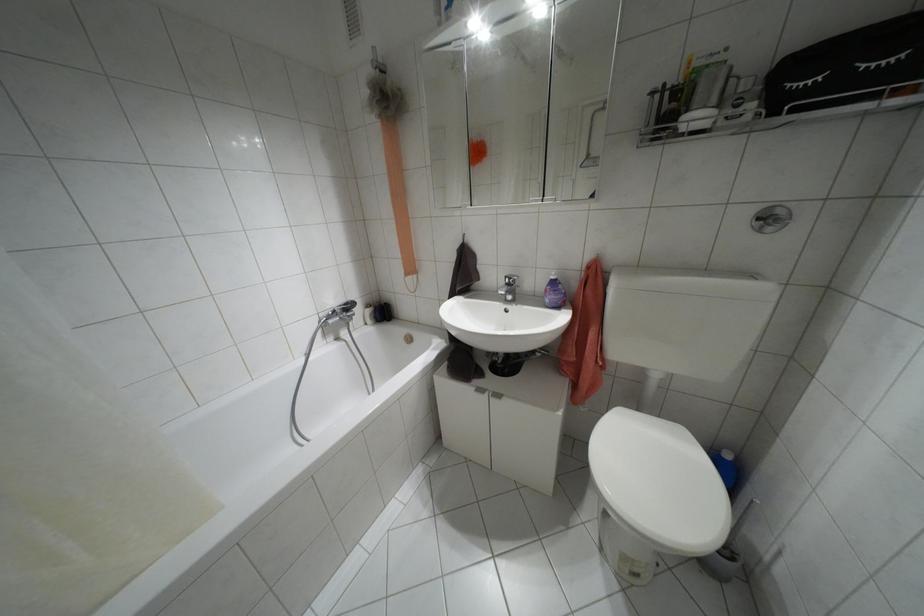
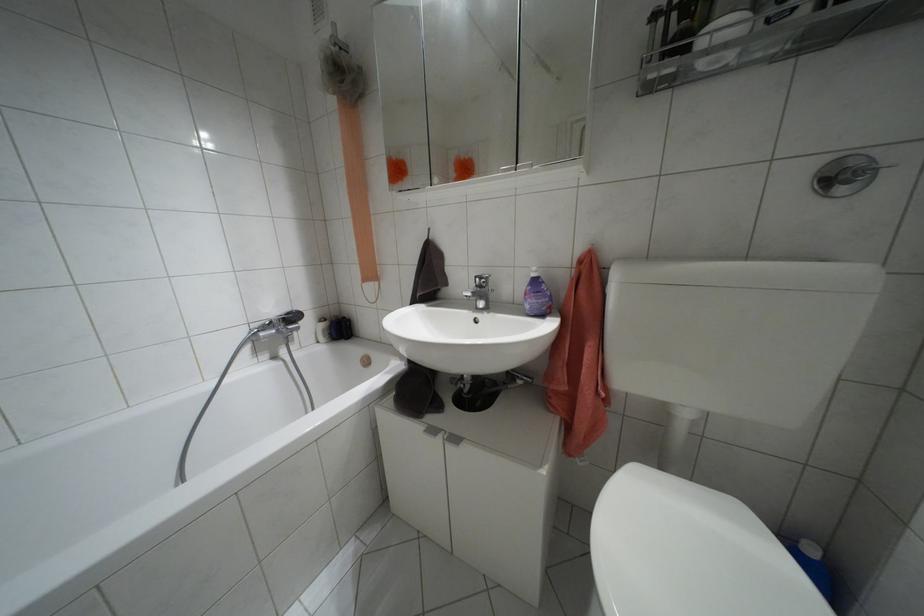
In a continuous first-person perspective shot, in which direction is the camera moving?

The movement direction of the cameraman is right, forward.